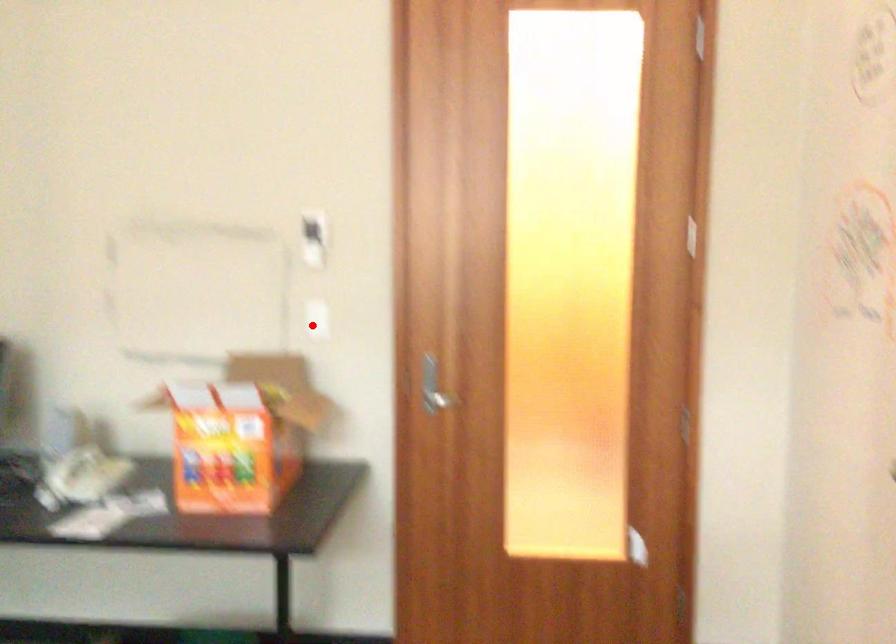
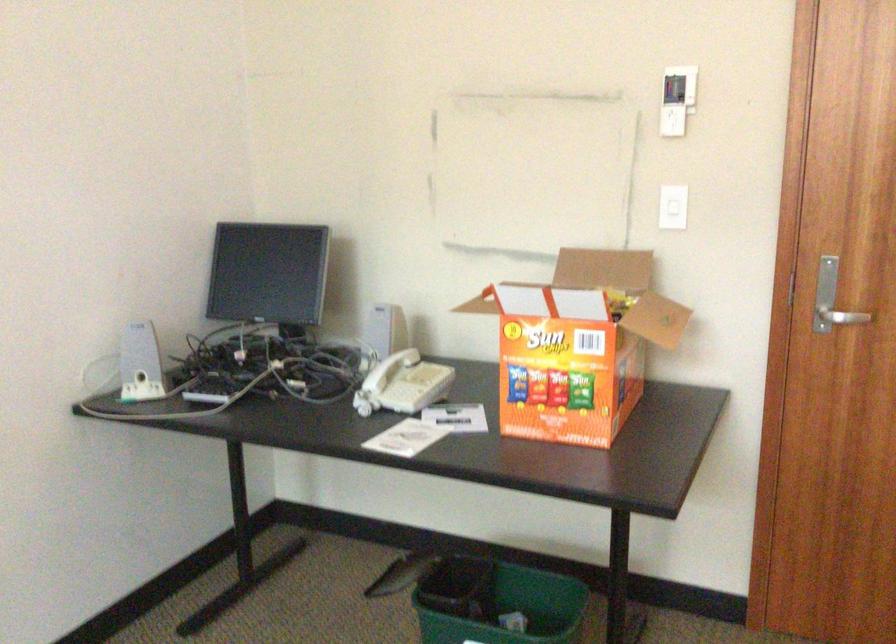
The point at the highlighted location is marked in the first image. Where is the corresponding point in the second image?

(672, 214)